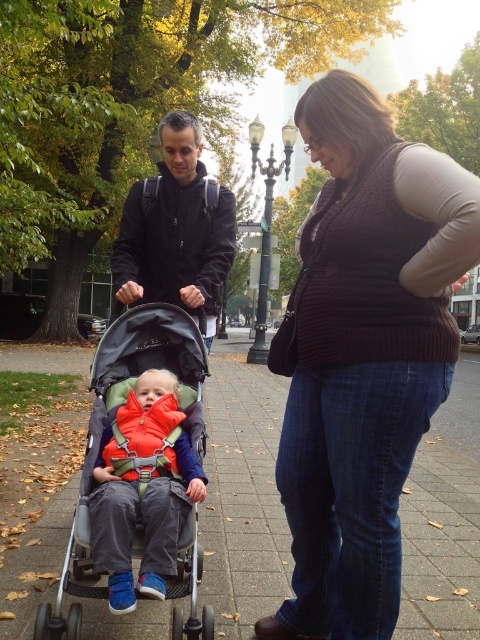
What do you see at coordinates (144, 490) in the screenshot? The height and width of the screenshot is (640, 480). I see `matte orange jacket at center` at bounding box center [144, 490].

Can you confirm if matte orange jacket at center is smaller than matte black jacket at center?

Correct, matte orange jacket at center occupies less space than matte black jacket at center.

Describe the element at coordinates (144, 490) in the screenshot. I see `matte orange jacket at center` at that location.

Where is `matte orange jacket at center`? matte orange jacket at center is located at coordinates pos(144,490).

Between knit sweater at center and gray concrete pavement at center, which one appears on the right side from the viewer's perspective?

Positioned to the right is gray concrete pavement at center.

Who is lower down, knit sweater at center or gray concrete pavement at center?

gray concrete pavement at center

Where is `knit sweater at center`? Image resolution: width=480 pixels, height=640 pixels. knit sweater at center is located at coordinates (362, 355).

Does knit sweater at center have a smaller size compared to silver metallic stroller at center?

Correct, knit sweater at center occupies less space than silver metallic stroller at center.

Does knit sweater at center have a lesser width compared to silver metallic stroller at center?

Correct, knit sweater at center's width is less than silver metallic stroller at center's.

Identify the location of knit sweater at center. Image resolution: width=480 pixels, height=640 pixels. (362, 355).